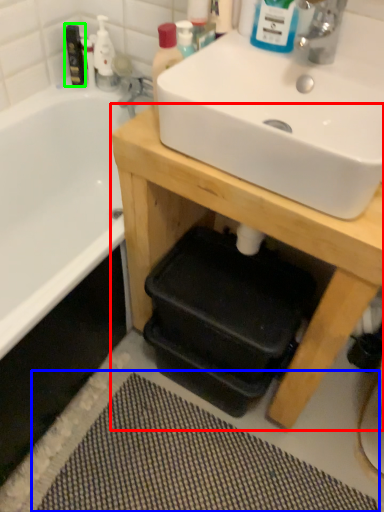
Question: Estimate the real-world distances between objects in this image. Which object is closer to table (highlighted by a red box), bath mat (highlighted by a blue box) or mouthwash (highlighted by a green box)?

Choices:
 (A) bath mat
 (B) mouthwash

Answer: (A)